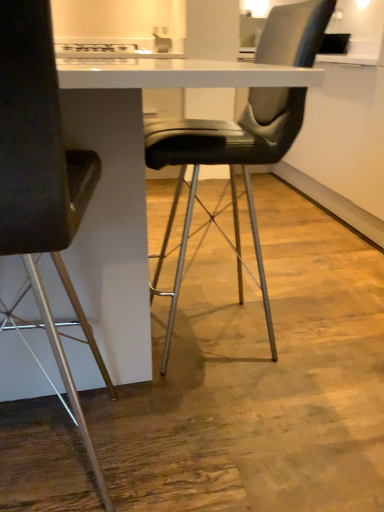
This screenshot has height=512, width=384. What are the coordinates of `vacant space in front of black leather chair at center, the first chair positioned from the right` in the screenshot? It's located at (286, 430).